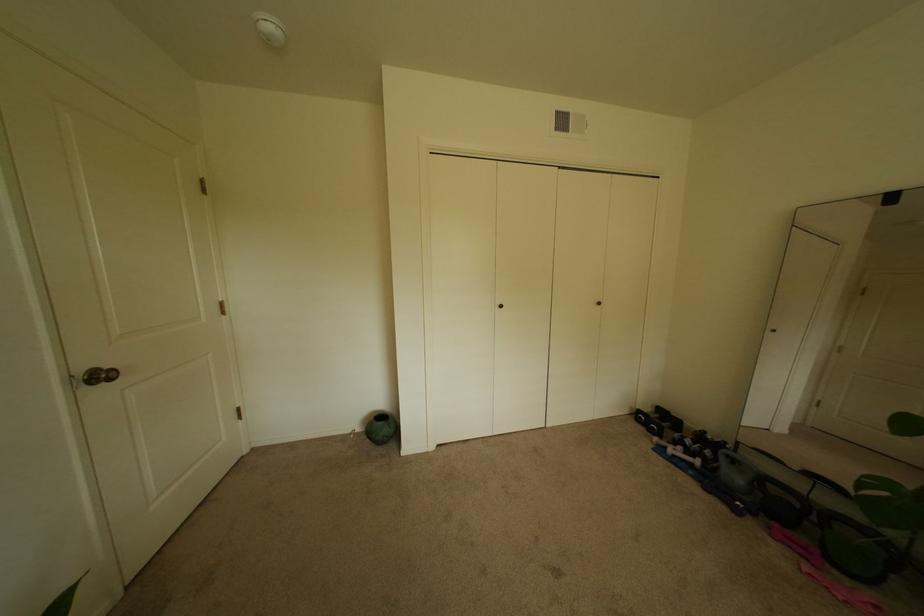
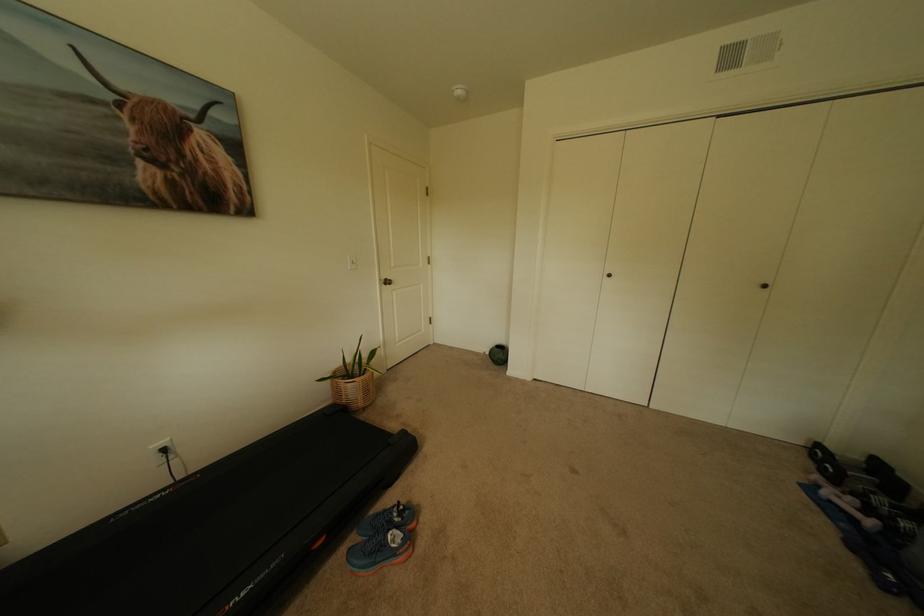
Locate, in the second image, the point that corresponds to point 89,373 in the first image.

(391, 280)